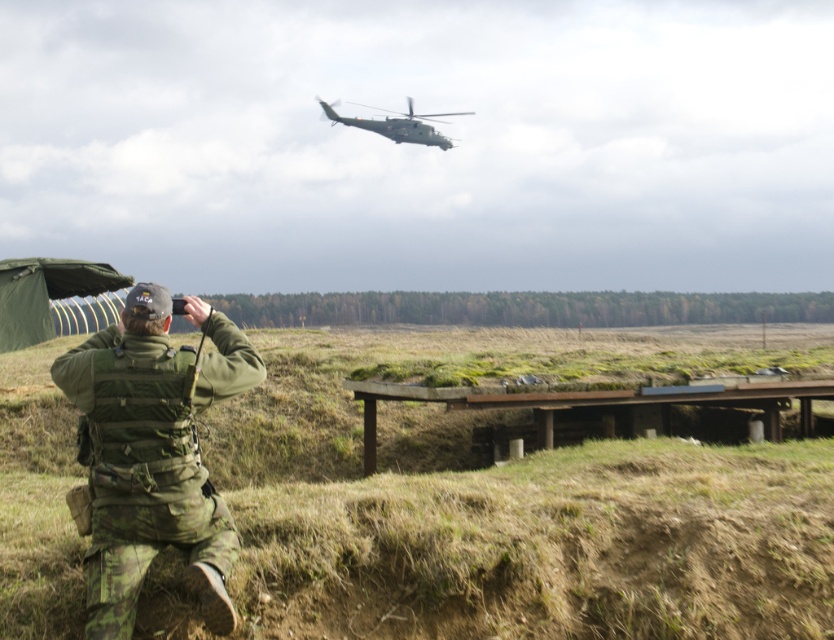
You are a hiker trying to decide where to set up your tent. You see a green camouflage field at lower left and a camouflage fabric uniform at lower left. Which area is larger and more suitable for setting up a tent?

The green camouflage field at lower left is bigger than the camouflage fabric uniform at lower left, so it is more suitable for setting up a tent.